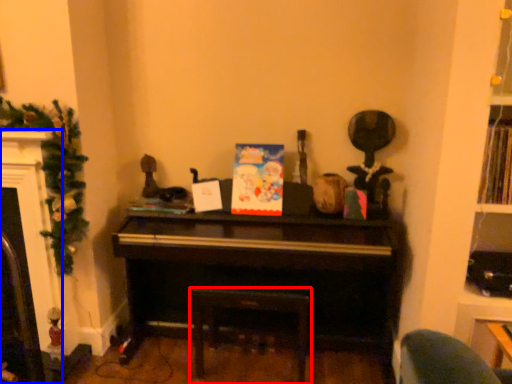
Question: Among these objects, which one is farthest to the camera, furniture (highlighted by a red box) or fireplace (highlighted by a blue box)?

Choices:
 (A) furniture
 (B) fireplace

Answer: (A)